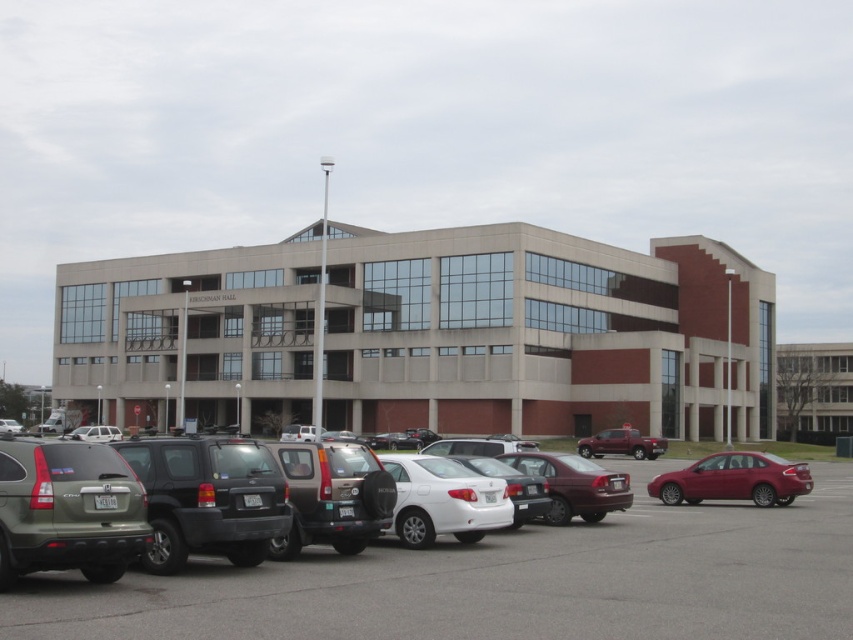
Question: Which object is closer to the camera taking this photo?

Choices:
 (A) matte silver suv at lower left
 (B) matte black suv at center
 (C) matte brown suv at center
 (D) shiny red sedan at lower right

Answer: (C)

Question: Among these objects, which one is farthest from the camera?

Choices:
 (A) metallic red truck at center-right
 (B) white glossy sedan at center
 (C) shiny red sedan at lower right

Answer: (A)

Question: Is metallic silver car at center to the left of maroon matte sedan at center from the viewer's perspective?

Choices:
 (A) no
 (B) yes

Answer: (A)

Question: Estimate the real-world distances between objects in this image. Which object is closer to the metallic silver car at center?

Choices:
 (A) matte silver suv at lower left
 (B) white matte sedan at center

Answer: (B)

Question: Is white glossy sedan at center in front of maroon matte sedan at center?

Choices:
 (A) no
 (B) yes

Answer: (B)

Question: Does matte brown suv at center appear on the left side of matte silver suv at lower left?

Choices:
 (A) no
 (B) yes

Answer: (A)